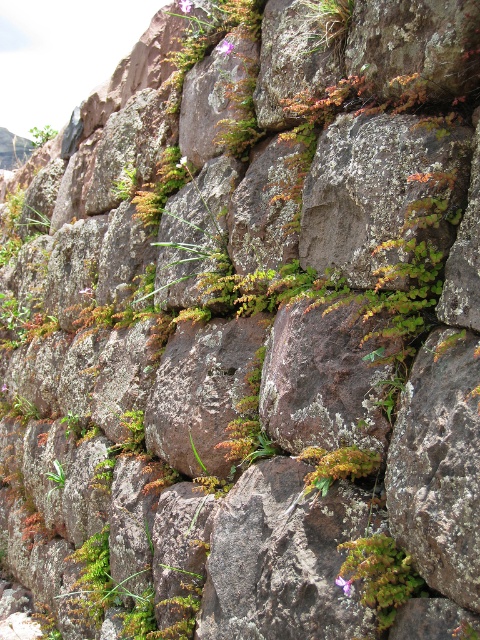
You are a gardener trying to determine which object to water first. You see the green mossy rock at upper center and the green mossy plant at center. Which one is wider?

The green mossy rock at upper center might be wider than green mossy plant at center.

You are a gardener inspecting the stone wall and notice the green mossy rock at upper center and the green mossy plant at center. Which of these two is closer to your current position?

The green mossy rock at upper center is closer to you because it is further to the viewer than the green mossy plant at center.

You are a gardener who wants to transplant the green mossy plant at lower right and the green mossy plant at center to a new garden bed. Which of the two plants requires a smaller space in terms of width?

The green mossy plant at lower right has a lesser width compared to the green mossy plant at center, so it requires a smaller space in terms of width.